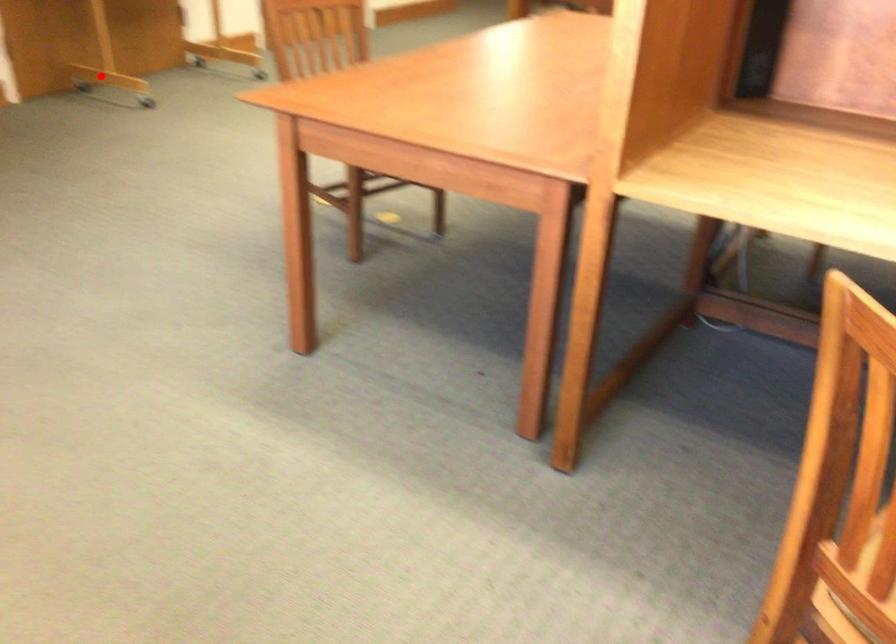
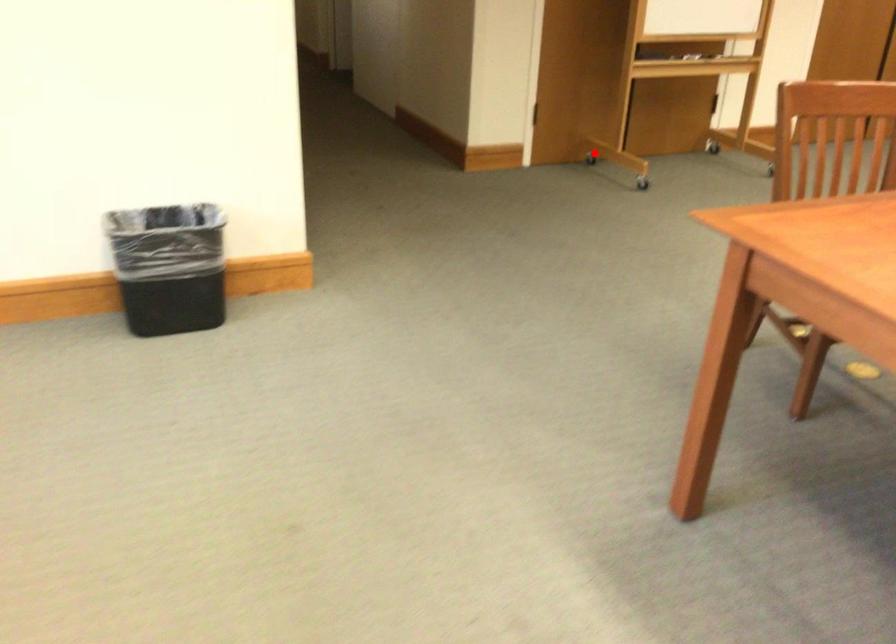
I am providing you with two images of the same scene from different viewpoints. A red point is marked on the first image and another point is marked on the second image. Is the marked point in image1 the same physical position as the marked point in image2?

Yes